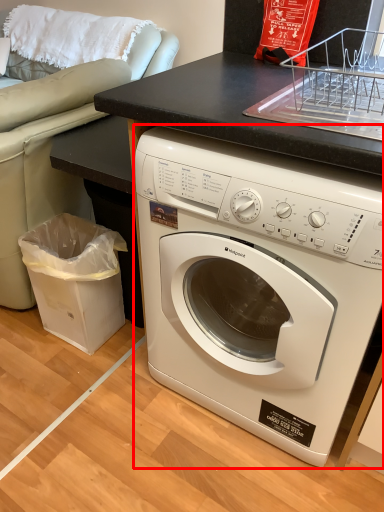
Question: Where is washing machine (annotated by the red box) located in relation to garbage in the image?

Choices:
 (A) left
 (B) right

Answer: (B)